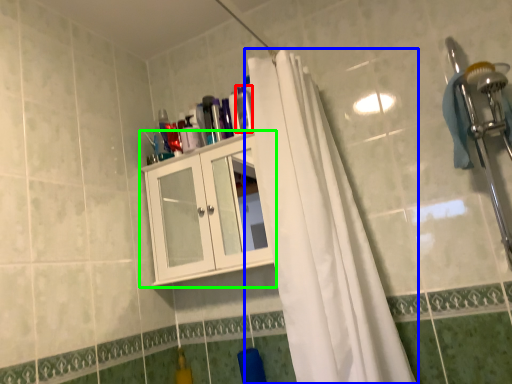
Question: Which object is positioned farthest from toiletry (highlighted by a red box)? Select from curtain (highlighted by a blue box) and cabinetry (highlighted by a green box).

Choices:
 (A) curtain
 (B) cabinetry

Answer: (A)